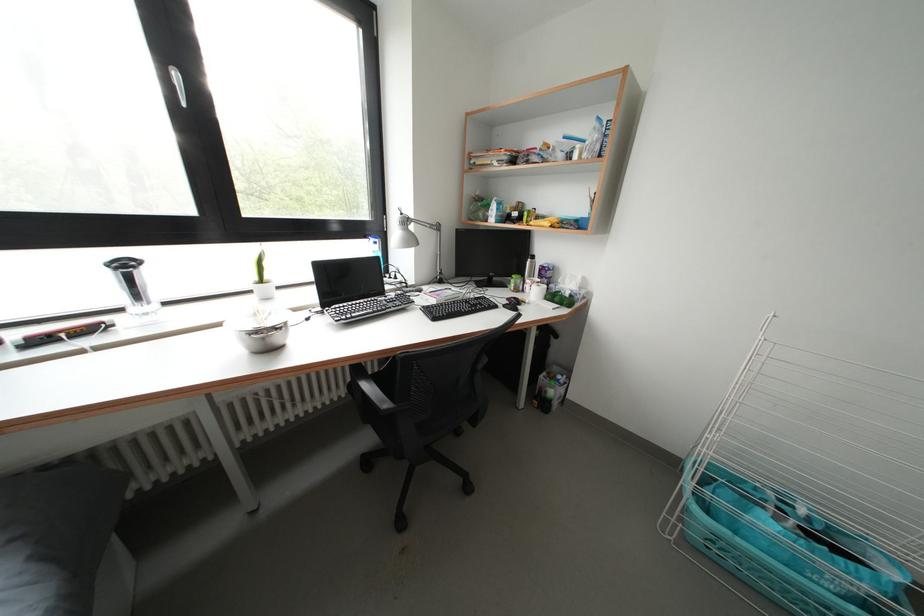
Which object does [512,304] point to?

This point indicates the black computer mouse.